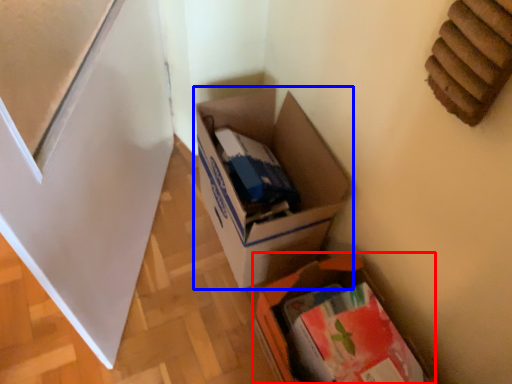
Question: Which object is further to the camera taking this photo, box (highlighted by a red box) or box (highlighted by a blue box)?

Choices:
 (A) box
 (B) box

Answer: (B)